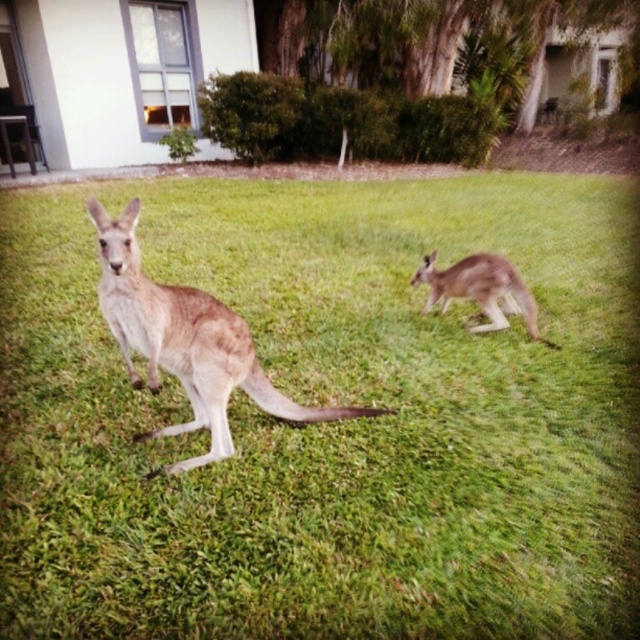
You are a photographer trying to capture both kangaroos in a single shot. You notice two points in the image labeled as point 1 at coordinates point [394,419] and point 2 at coordinates point [129,308]. Which point is closer to the camera?

Point [394,419] is closer to the camera than point [129,308].

You are a photographer trying to capture the kangaroo in the image. If you want to focus on the light brown fur kangaroo at center, where should you aim your camera? Please provide the coordinates in the format of a point like this example format, e.g., point at point 0.536, 0.292.

The light brown fur kangaroo at center is located at point (186, 342), so you should aim your camera at point (186, 342).

You are a photographer trying to capture both kangaroos in a single shot. The kangaroo at point (504, 570) and the one at point (465, 275) are both in your viewfinder. Which kangaroo is closer to your camera?

The kangaroo at point (504, 570) is closer to the camera than the one at point (465, 275).